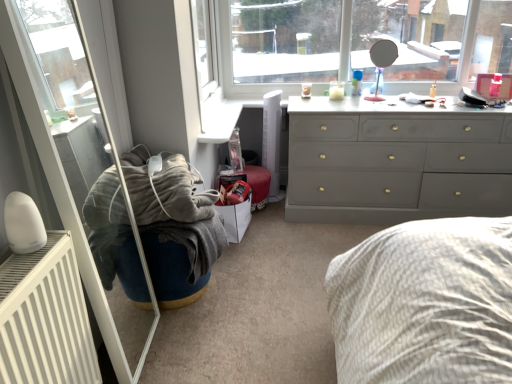
Question: Looking at their shapes, would you say white cardboard shoe box at lower center is wider or thinner than dark blue fabric bean bag chair at center?

Choices:
 (A) wide
 (B) thin

Answer: (B)

Question: Is white cardboard shoe box at lower center inside or outside of dark blue fabric bean bag chair at center?

Choices:
 (A) outside
 (B) inside

Answer: (A)

Question: Estimate the real-world distances between objects in this image. Which object is closer to the white glossy radiator at left?

Choices:
 (A) matte gray dresser at upper right
 (B) dark blue fabric bean bag chair at center
 (C) white cardboard shoe box at lower center
 (D) white metallic radiator at lower left

Answer: (B)

Question: Which is nearer to the dark blue fabric bean bag chair at center?

Choices:
 (A) white metallic radiator at lower left
 (B) white cardboard shoe box at lower center
 (C) white glossy radiator at left
 (D) matte gray dresser at upper right

Answer: (C)